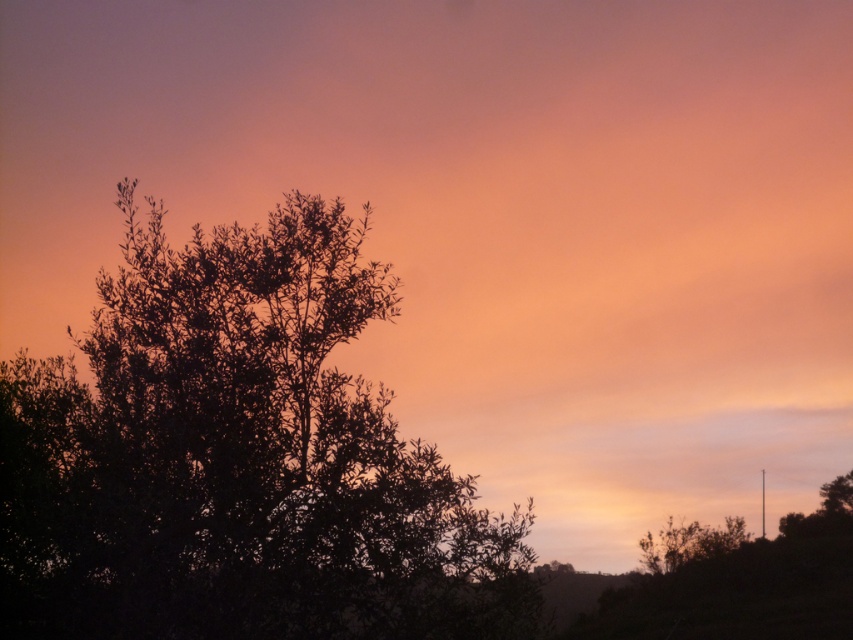
Is dark green leafy tree at left closer to camera compared to green leafy bush at lower right?

Yes, it is in front of green leafy bush at lower right.

Is dark green leafy tree at left below green leafy bush at lower right?

Actually, dark green leafy tree at left is above green leafy bush at lower right.

Describe the element at coordinates (239, 458) in the screenshot. This screenshot has height=640, width=853. I see `dark green leafy tree at left` at that location.

At what (x,y) coordinates should I click in order to perform the action: click on dark green leafy tree at left. Please return your answer as a coordinate pair (x, y). Looking at the image, I should click on (239, 458).